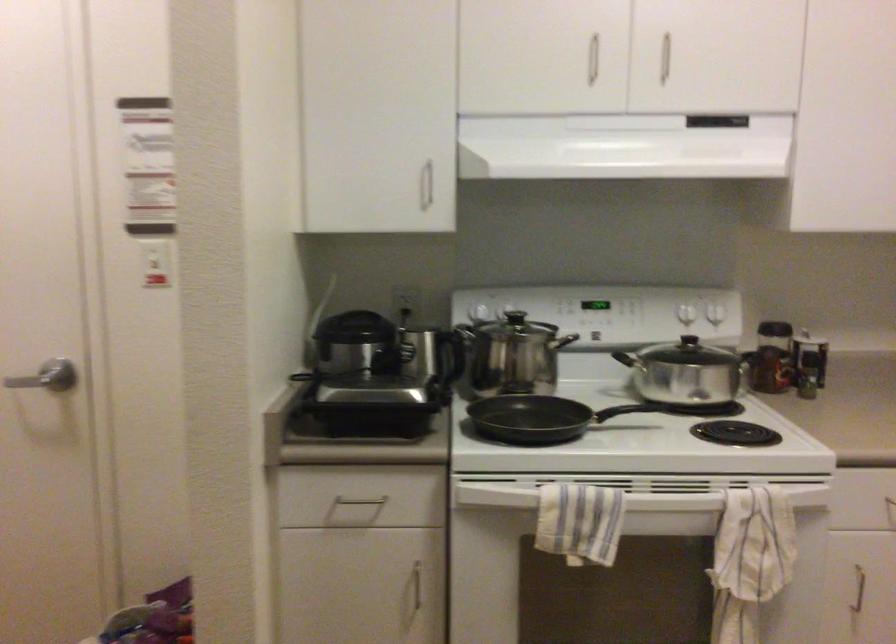
The image size is (896, 644). In order to click on silver door handle in this screenshot , I will do 33,382.